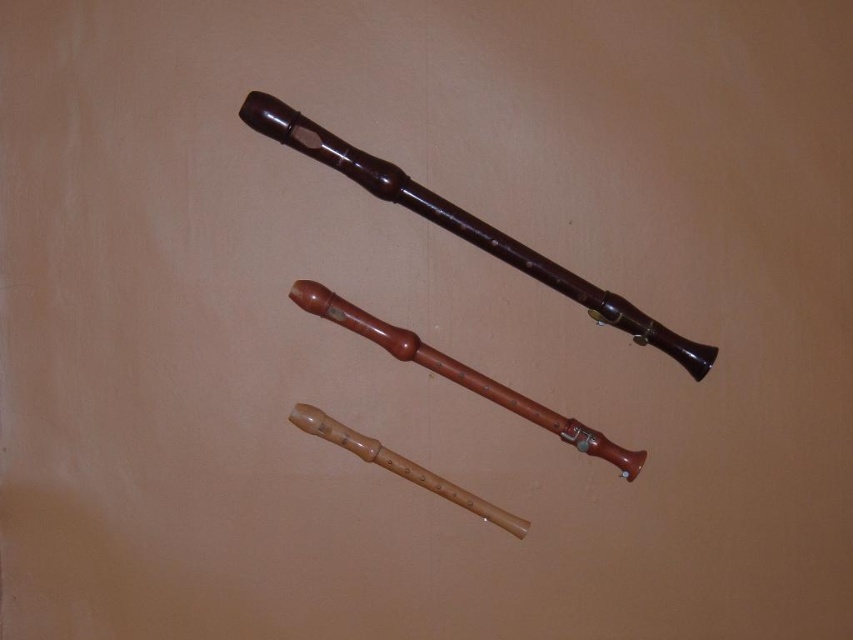
Is point (339, 156) closer to viewer compared to point (303, 285)?

Yes, point (339, 156) is closer to viewer.

Does matte brown flute at upper center lie in front of light brown wood flute at center?

Yes.

Identify the location of matte brown flute at upper center. The width and height of the screenshot is (853, 640). (465, 227).

Which is above, matte brown flute at upper center or natural wood flute at center?

matte brown flute at upper center is above.

Does point (271, 115) come behind point (320, 435)?

No, (271, 115) is closer to viewer.

Identify the location of matte brown flute at upper center. (465, 227).

Which is in front, point (498, 390) or point (432, 476)?

Point (432, 476)

Where is `light brown wood flute at center`? The height and width of the screenshot is (640, 853). light brown wood flute at center is located at coordinates 460,372.